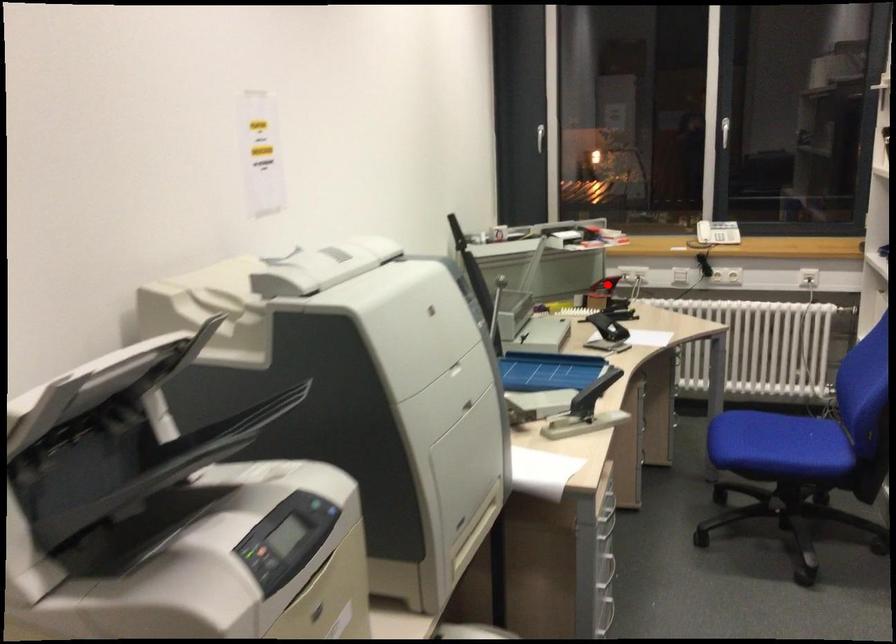
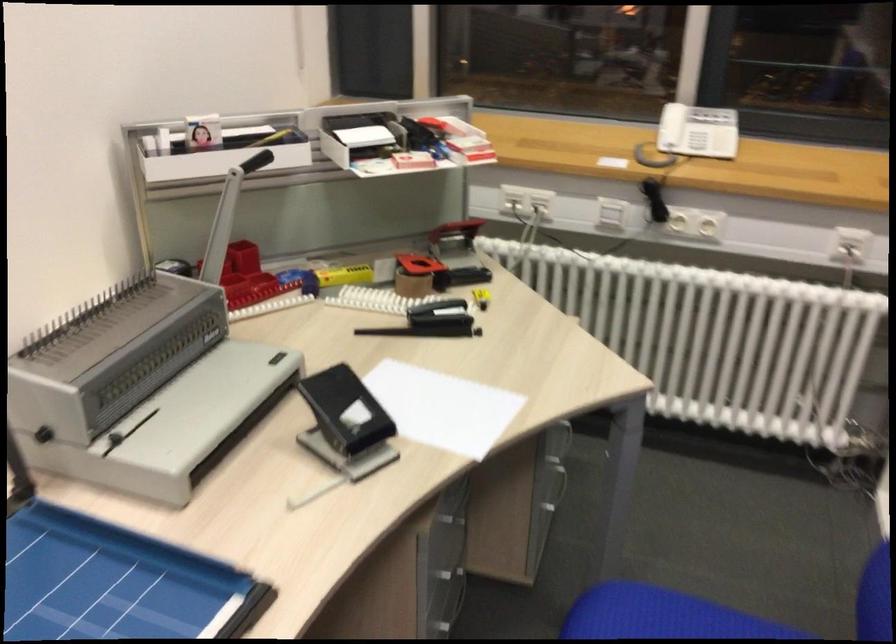
Question: A red point is marked in image1. In image2, is the corresponding 3D point closer to the camera or farther? Reply with the corresponding letter.

Choices:
 (A) The corresponding 3D point is closer.
 (B) The corresponding 3D point is farther.

Answer: (A)